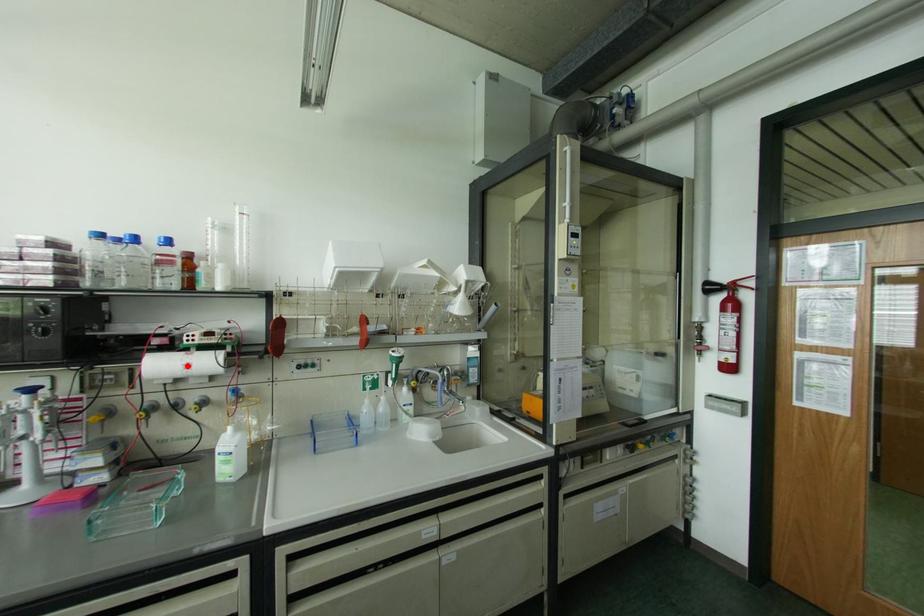
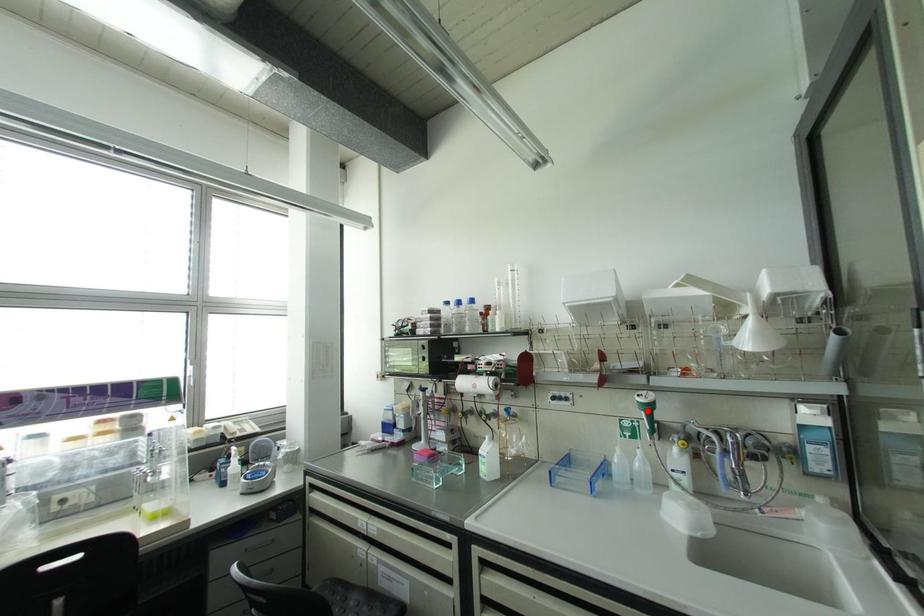
I am providing you with two images of the same scene from different viewpoints. A red point is marked on the first image and another point is marked on the second image. Is the marked point in image1 the same physical position as the marked point in image2?

No